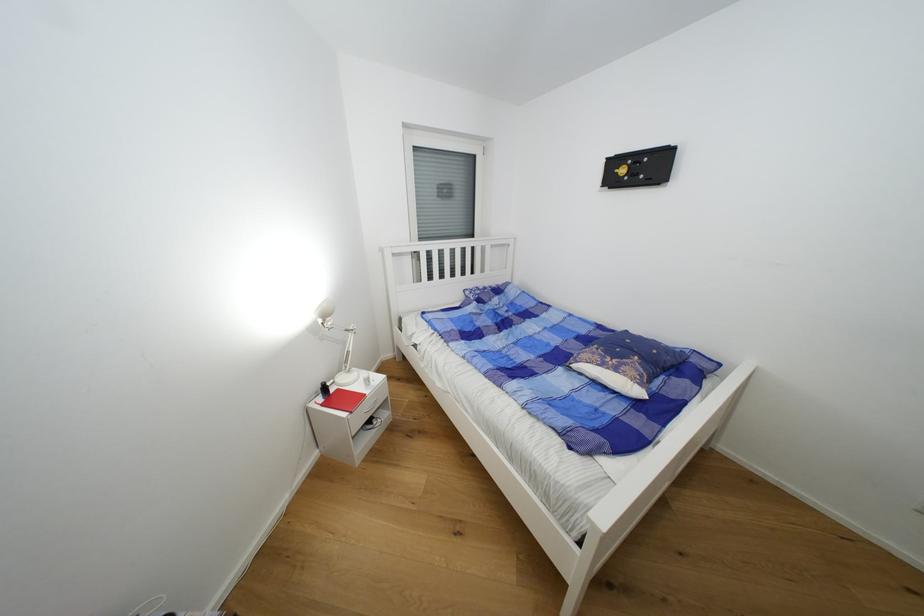
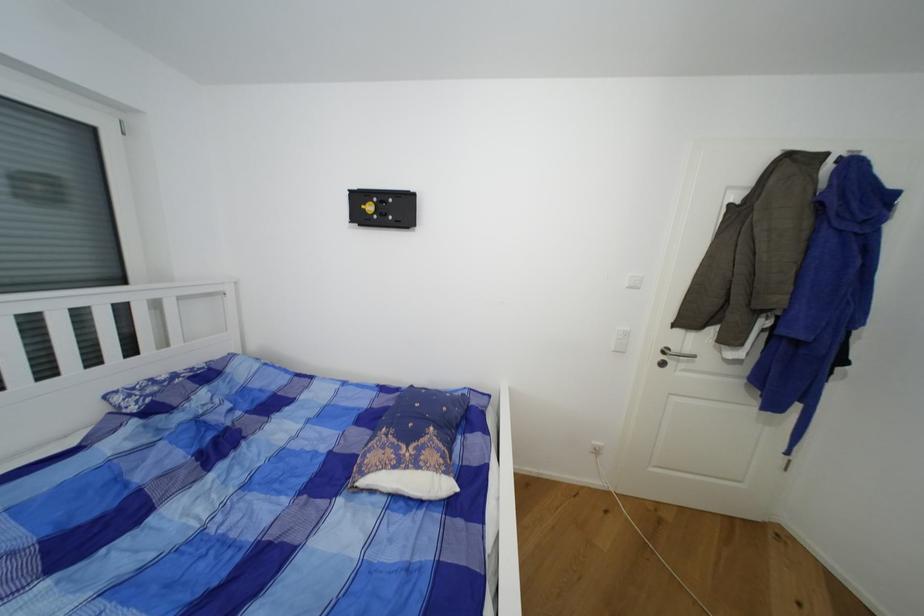
Question: The camera is either moving clockwise (left) or counter-clockwise (right) around the object. The first image is from the beginning of the video and the second image is from the end. Is the camera moving left or right when shooting the video?

Choices:
 (A) Left
 (B) Right

Answer: (A)